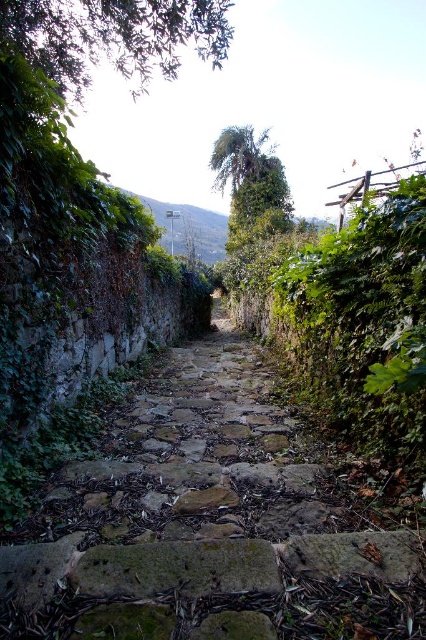
Question: Is green mossy stone at center to the left of green leafy hillside at center from the viewer's perspective?

Choices:
 (A) yes
 (B) no

Answer: (B)

Question: Which object is positioned farthest from the green leafy hillside at center?

Choices:
 (A) brown rough stone at center
 (B) green mossy stone at center

Answer: (B)

Question: Does green mossy stone at center appear over brown rough stone at center?

Choices:
 (A) no
 (B) yes

Answer: (A)

Question: Which object appears closest to the camera in this image?

Choices:
 (A) green leafy hillside at center
 (B) brown rough stone at center

Answer: (B)

Question: Does green mossy stone at center have a smaller size compared to brown rough stone at center?

Choices:
 (A) no
 (B) yes

Answer: (A)

Question: Estimate the real-world distances between objects in this image. Which object is farther from the green leafy hillside at center?

Choices:
 (A) brown rough stone at center
 (B) green mossy stone at center

Answer: (B)